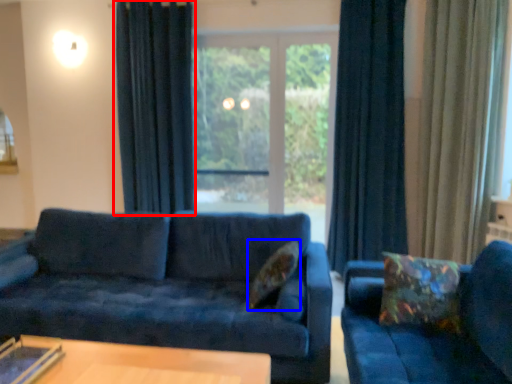
Question: Which object appears closest to the camera in this image, curtain (highlighted by a red box) or pillow (highlighted by a blue box)?

Choices:
 (A) curtain
 (B) pillow

Answer: (B)